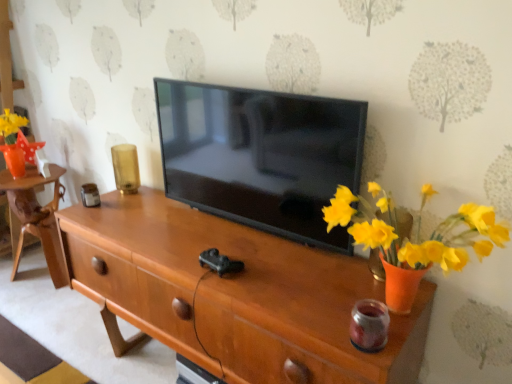
I want to click on vacant area situated below black glossy tv at center (from a real-world perspective), so click(x=249, y=224).